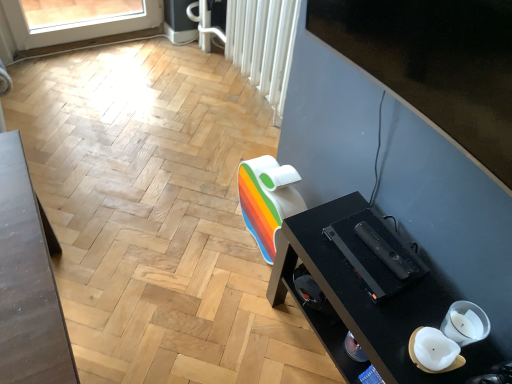
Describe the element at coordinates (435, 63) in the screenshot. The width and height of the screenshot is (512, 384). I see `black glossy tv at upper right` at that location.

Image resolution: width=512 pixels, height=384 pixels. What do you see at coordinates (368, 298) in the screenshot?
I see `black glossy desk at lower right` at bounding box center [368, 298].

Locate an element on the screen. The width and height of the screenshot is (512, 384). white textured radiator at upper center is located at coordinates (263, 45).

You are a GUI agent. You are given a task and a screenshot of the screen. Output one action in this format:
    pyautogui.click(x=<x>, y=<y>)
    Task: Click on the desk beneath the white textured radiator at upper center (from a real-world perspective)
    The width and height of the screenshot is (512, 384).
    Given the screenshot: What is the action you would take?
    pyautogui.click(x=368, y=298)

Between point (416, 324) and point (263, 3), which one is positioned in front?

Point (416, 324)

Considering the positions of objects black glossy desk at lower right and white textured radiator at upper center in the image provided, who is more to the left, black glossy desk at lower right or white textured radiator at upper center?

From the viewer's perspective, white textured radiator at upper center appears more on the left side.

From the image's perspective, between black glossy desk at lower right and white textured radiator at upper center, which one is located above?

From the image's view, white textured radiator at upper center is above.

Is white textured radiator at upper center not near black glossy desk at lower right?

No, white textured radiator at upper center is not far away from black glossy desk at lower right.

Between white textured radiator at upper center and black glossy desk at lower right, which one has larger size?

black glossy desk at lower right.

How different are the orientations of white textured radiator at upper center and black glossy desk at lower right in degrees?

The facing directions of white textured radiator at upper center and black glossy desk at lower right are 2.48 degrees apart.

From the image's perspective, which object appears higher, white textured radiator at upper center or black glossy desk at lower right?

white textured radiator at upper center, from the image's perspective.

Considering the sizes of objects black glossy tv at upper right and black glossy desk at lower right in the image provided, who is shorter, black glossy tv at upper right or black glossy desk at lower right?

With less height is black glossy tv at upper right.

Consider the image. Is black glossy tv at upper right touching black glossy desk at lower right?

There is a gap between black glossy tv at upper right and black glossy desk at lower right.

Considering the relative sizes of black glossy tv at upper right and black glossy desk at lower right in the image provided, is black glossy tv at upper right wider than black glossy desk at lower right?

No, black glossy tv at upper right is not wider than black glossy desk at lower right.

From the image's perspective, which object appears higher, black glossy tv at upper right or black glossy desk at lower right?

black glossy tv at upper right appears higher in the image.

From the image's perspective, which is below, black glossy tv at upper right or white textured radiator at upper center?

From the image's view, black glossy tv at upper right is below.

Is black glossy tv at upper right turned away from white textured radiator at upper center?

No, black glossy tv at upper right is not facing the opposite direction of white textured radiator at upper center.

In terms of height, does black glossy tv at upper right look taller or shorter compared to white textured radiator at upper center?

Considering their sizes, black glossy tv at upper right has less height than white textured radiator at upper center.

From a real-world perspective, who is located higher, black glossy tv at upper right or white textured radiator at upper center?

In real-world perspective, black glossy tv at upper right is above.

How different are the orientations of white textured radiator at upper center and black glossy tv at upper right in degrees?

The angle between the facing direction of white textured radiator at upper center and the facing direction of black glossy tv at upper right is 3.02 degrees.

How far apart are white textured radiator at upper center and black glossy tv at upper right?

A distance of 31.57 inches exists between white textured radiator at upper center and black glossy tv at upper right.

Who is more distant, white textured radiator at upper center or black glossy tv at upper right?

white textured radiator at upper center is more distant.

Image resolution: width=512 pixels, height=384 pixels. Identify the location of window screen that is on the right side of white textured radiator at upper center. (435, 63).

Does black glossy desk at lower right lie in front of black glossy tv at upper right?

That is False.

From a real-world perspective, is black glossy desk at lower right located higher than black glossy tv at upper right?

Actually, black glossy desk at lower right is physically below black glossy tv at upper right in the real world.

Which is correct: black glossy desk at lower right is inside black glossy tv at upper right, or outside of it?

black glossy desk at lower right is located beyond the bounds of black glossy tv at upper right.

Where is `desk that is under the white textured radiator at upper center (from a real-world perspective)`? desk that is under the white textured radiator at upper center (from a real-world perspective) is located at coordinates (368, 298).

This screenshot has height=384, width=512. In order to click on radiator above the black glossy desk at lower right (from the image's perspective) in this screenshot , I will do `click(263, 45)`.

Looking at this image, when comparing their distances from black glossy desk at lower right, does black glossy tv at upper right or white textured radiator at upper center seem closer?

black glossy tv at upper right is closer to black glossy desk at lower right.

Estimate the real-world distances between objects in this image. Which object is further from black glossy tv at upper right, white textured radiator at upper center or black glossy desk at lower right?

white textured radiator at upper center.

Based on their spatial positions, is black glossy tv at upper right or black glossy desk at lower right further from white textured radiator at upper center?

black glossy desk at lower right.

From the image, which object appears to be nearer to black glossy tv at upper right, black glossy desk at lower right or white textured radiator at upper center?

Among the two, black glossy desk at lower right is located nearer to black glossy tv at upper right.

Which object lies further to the anchor point white textured radiator at upper center, black glossy desk at lower right or black glossy tv at upper right?

black glossy desk at lower right lies further to white textured radiator at upper center than the other object.

Which object lies nearer to the anchor point black glossy desk at lower right, white textured radiator at upper center or black glossy tv at upper right?

Among the two, black glossy tv at upper right is located nearer to black glossy desk at lower right.

The image size is (512, 384). Identify the location of desk between black glossy tv at upper right and white textured radiator at upper center along the z-axis. (368, 298).